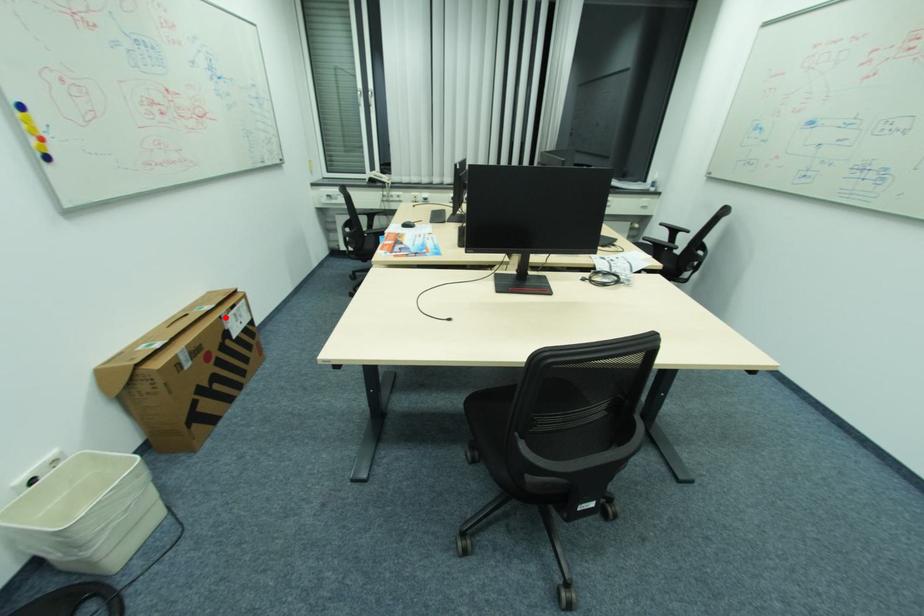
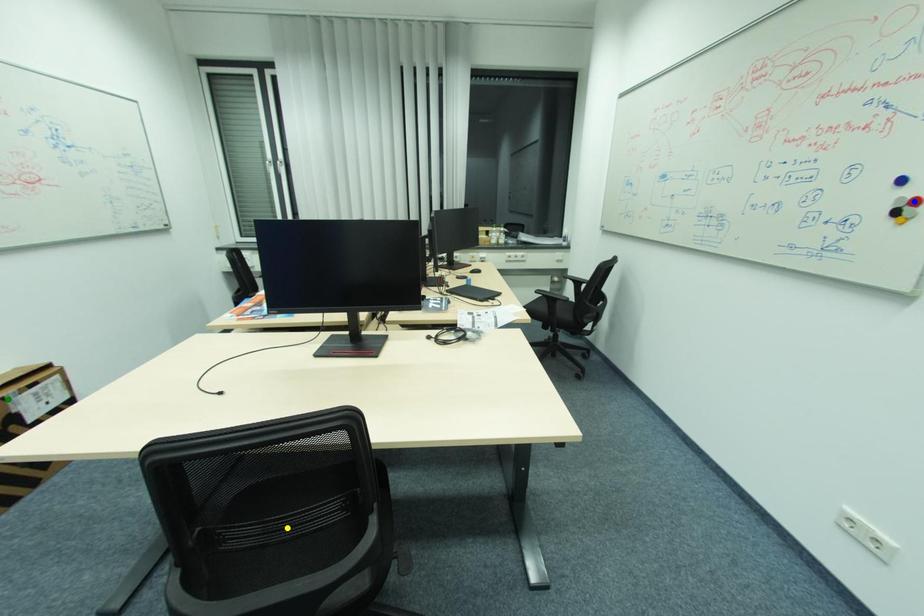
Question: I am providing you with two images of the same scene from different viewpoints. A red point is marked on the first image. You are given multiple points on the second image. Which point in image 2 represents the same 3d spot as the red point in image 1?

Choices:
 (A) green point
 (B) yellow point
 (C) blue point

Answer: (A)